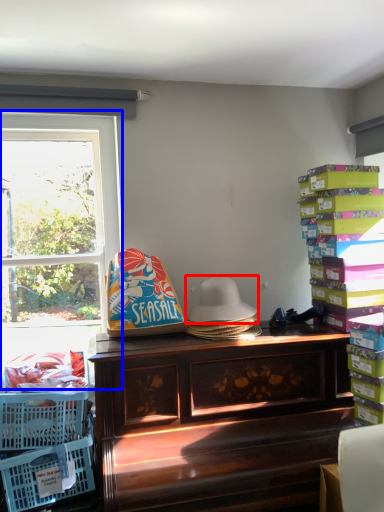
Question: Which object is closer to the camera taking this photo, hat (highlighted by a red box) or window (highlighted by a blue box)?

Choices:
 (A) hat
 (B) window

Answer: (A)